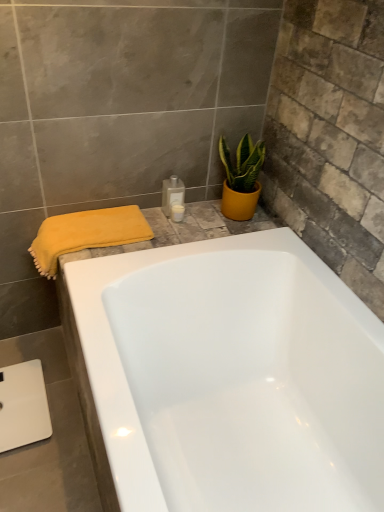
At what (x,y) coordinates should I click in order to perform the action: click on vacant area that is in front of translucent plastic bottle at upper center, the first toiletry from the top. Please return your answer as a coordinate pair (x, y). Looking at the image, I should click on (165, 232).